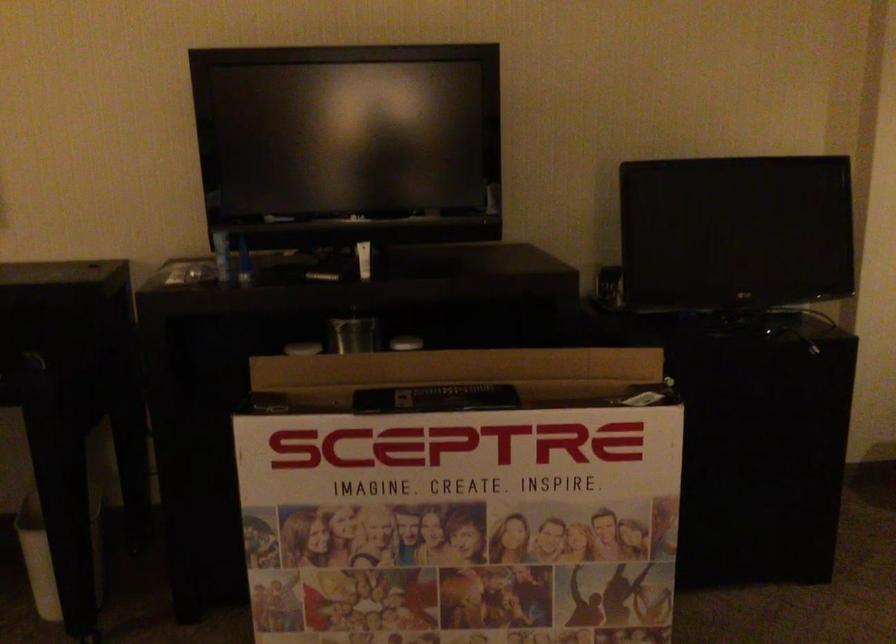
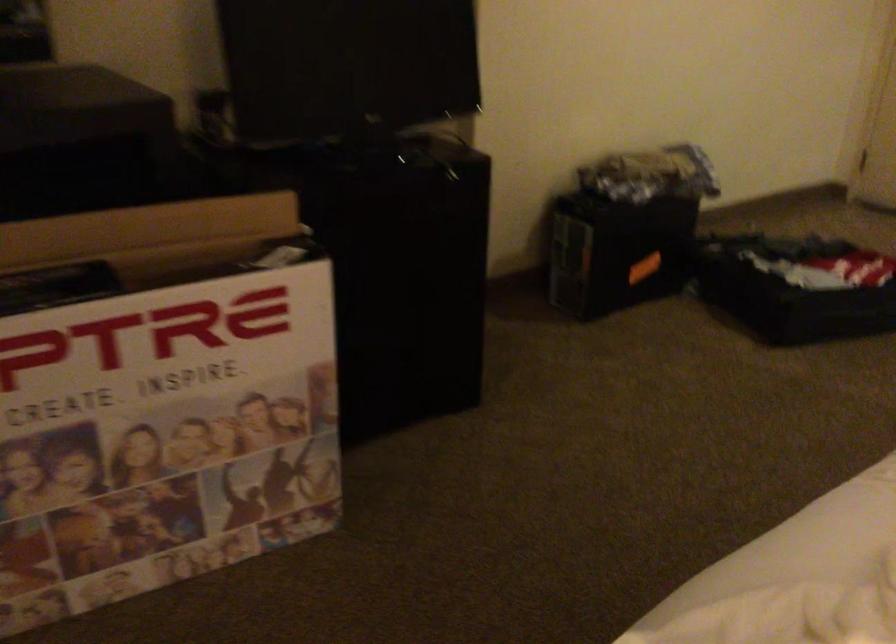
Question: Based on the continuous images, in which direction is the camera rotating? Reply with the corresponding letter.

Choices:
 (A) Left
 (B) Right
 (C) Up
 (D) Down

Answer: (B)